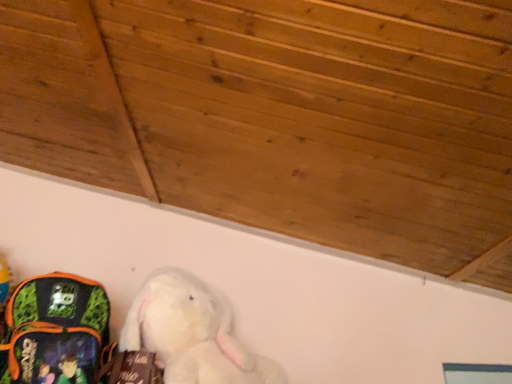
The width and height of the screenshot is (512, 384). Find the location of `green camouflage backpack at lower left`. green camouflage backpack at lower left is located at coordinates (55, 331).

The height and width of the screenshot is (384, 512). Describe the element at coordinates (55, 331) in the screenshot. I see `green camouflage backpack at lower left` at that location.

Identify the location of green camouflage backpack at lower left. (55, 331).